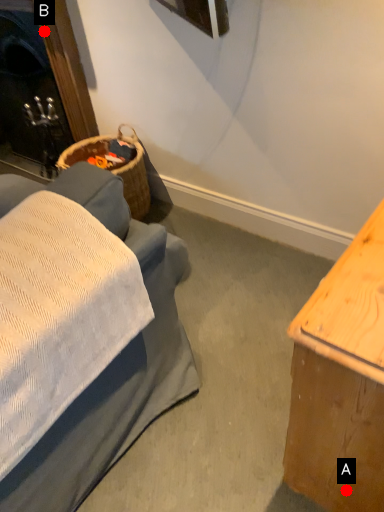
Question: Two points are circled on the image, labeled by A and B beside each circle. Which point is farther to the camera?

Choices:
 (A) A is further
 (B) B is further

Answer: (B)